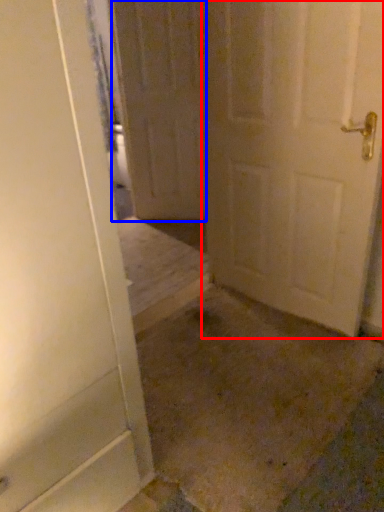
Question: Which object appears farthest to the camera in this image, door (highlighted by a red box) or door (highlighted by a blue box)?

Choices:
 (A) door
 (B) door

Answer: (B)